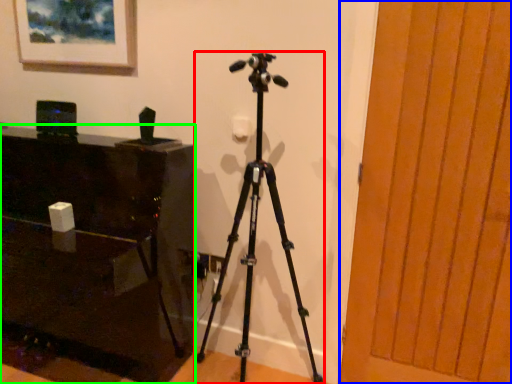
Question: Based on their relative distances, which object is nearer to tripod (highlighted by a red box)? Choose from glass door (highlighted by a blue box) and furniture (highlighted by a green box).

Choices:
 (A) glass door
 (B) furniture

Answer: (B)